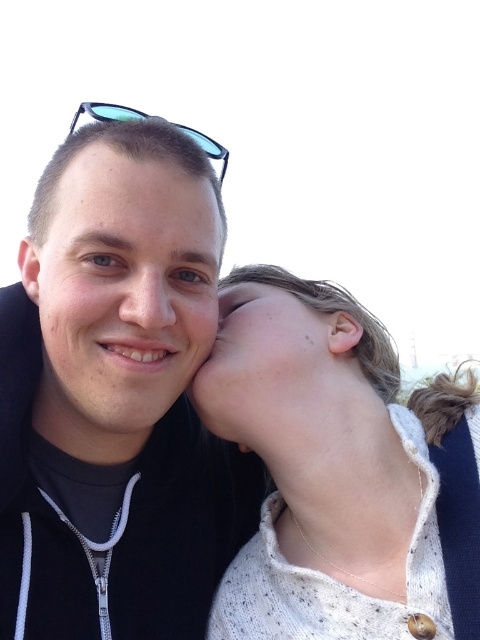
Does matte black face at center appear on the left side of matte skin forehead at center?

Yes, matte black face at center is to the left of matte skin forehead at center.

Does matte black face at center appear over matte skin forehead at center?

No.

Image resolution: width=480 pixels, height=640 pixels. In order to click on matte black face at center in this screenshot , I will do (x=121, y=292).

The height and width of the screenshot is (640, 480). Find the location of `black matte jacket at center`. black matte jacket at center is located at coordinates (117, 397).

Consider the image. Which is below, black matte jacket at center or matte skin forehead at center?

black matte jacket at center is lower down.

The image size is (480, 640). What do you see at coordinates (117, 397) in the screenshot? I see `black matte jacket at center` at bounding box center [117, 397].

Identify the location of black matte jacket at center. The width and height of the screenshot is (480, 640). (117, 397).

Can you confirm if black matte jacket at center is shorter than matte black face at center?

No, black matte jacket at center is not shorter than matte black face at center.

The height and width of the screenshot is (640, 480). What do you see at coordinates (117, 397) in the screenshot?
I see `black matte jacket at center` at bounding box center [117, 397].

Where is `black matte jacket at center`? This screenshot has width=480, height=640. black matte jacket at center is located at coordinates (x=117, y=397).